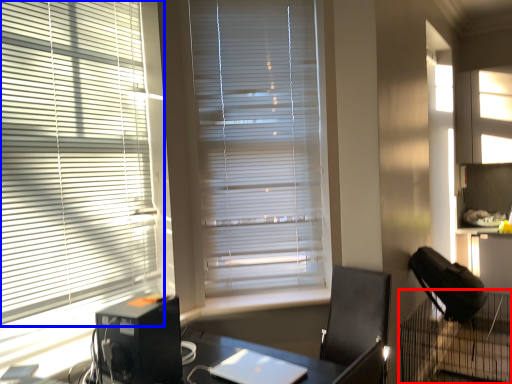
Question: Which object appears closest to the camera in this image, computer desk (highlighted by a red box) or window blind (highlighted by a blue box)?

Choices:
 (A) computer desk
 (B) window blind

Answer: (B)